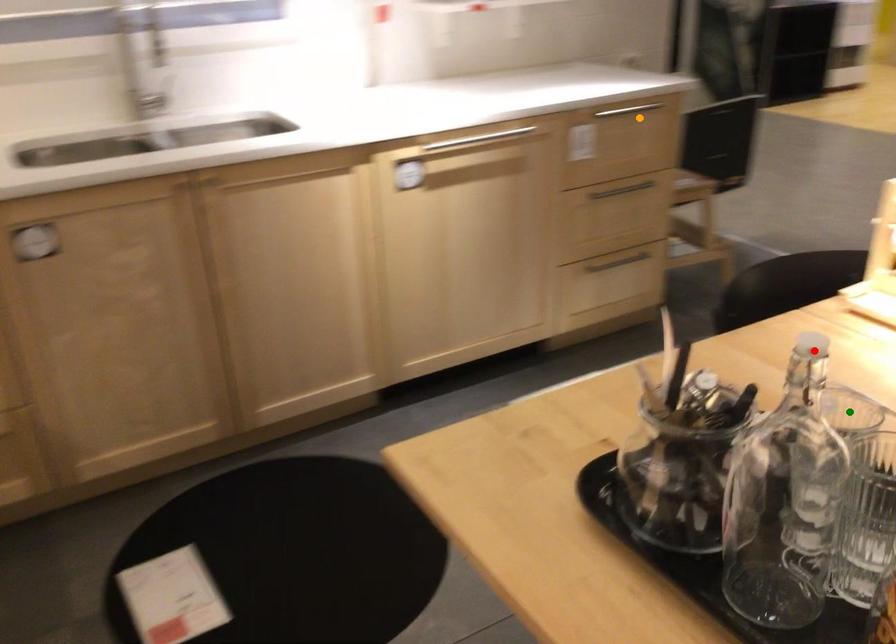
Order these from nearest to farthest:
1. green point
2. red point
3. orange point

orange point → green point → red point